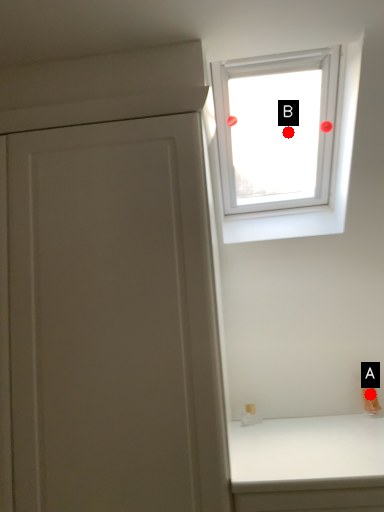
Question: Two points are circled on the image, labeled by A and B beside each circle. Which point is further to the camera?

Choices:
 (A) A is further
 (B) B is further

Answer: (B)